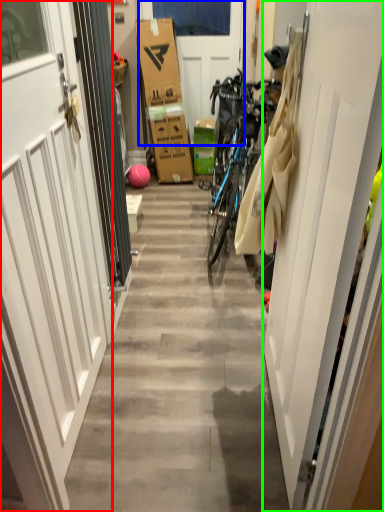
Question: Considering the real-world distances, which object is farthest from door (highlighted by a red box)? door (highlighted by a blue box) or door (highlighted by a green box)?

Choices:
 (A) door
 (B) door

Answer: (A)